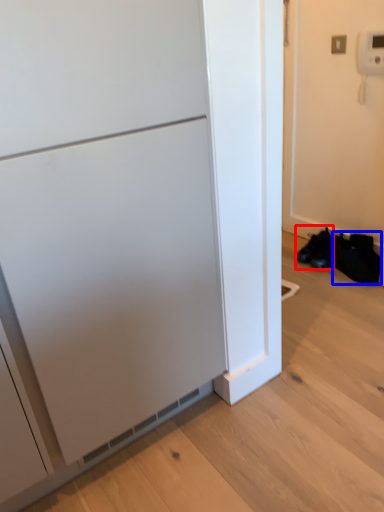
Question: Which point is closer to the camera, footwear (highlighted by a red box) or shoe (highlighted by a blue box)?

Choices:
 (A) footwear
 (B) shoe

Answer: (B)